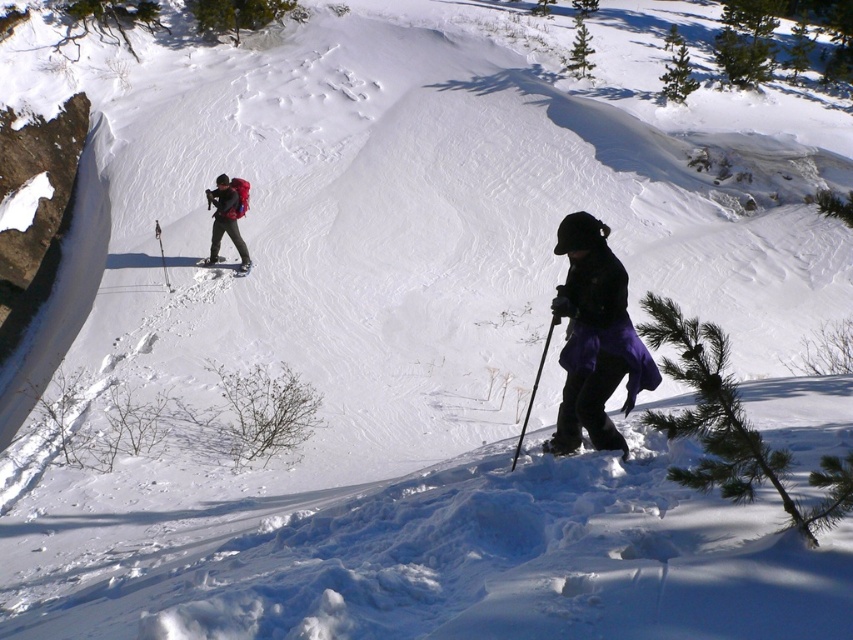
Question: Which is farther from the black plastic ski pole at lower center?

Choices:
 (A) purple fabric skirt at lower center
 (B) green needle-like pine at lower right

Answer: (B)

Question: Does matte red backpack at upper left appear over black plastic ski pole at lower center?

Choices:
 (A) no
 (B) yes

Answer: (B)

Question: Which object appears farthest from the camera in this image?

Choices:
 (A) matte black ski at upper center
 (B) green needle-like pine at lower right
 (C) matte red backpack at upper left
 (D) purple fabric skirt at lower center

Answer: (A)

Question: Does green needle-like pine at lower right have a greater width compared to matte red backpack at upper left?

Choices:
 (A) yes
 (B) no

Answer: (A)

Question: Is purple fabric skirt at lower center smaller than matte black ski at upper center?

Choices:
 (A) yes
 (B) no

Answer: (B)

Question: Estimate the real-world distances between objects in this image. Which object is closer to the matte red backpack at upper left?

Choices:
 (A) green needle-like pine at lower right
 (B) black plastic ski pole at lower center

Answer: (B)